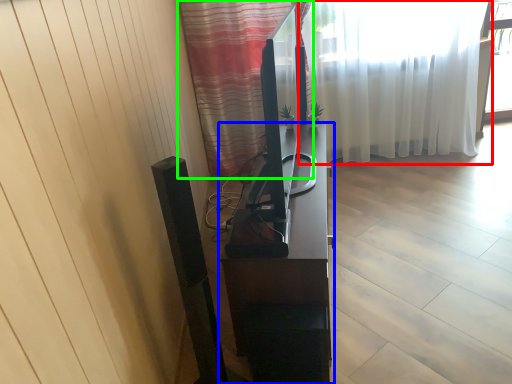
Question: Which object is positioned farthest from curtain (highlighted by a red box)? Select from furniture (highlighted by a blue box) and curtain (highlighted by a green box).

Choices:
 (A) furniture
 (B) curtain

Answer: (A)